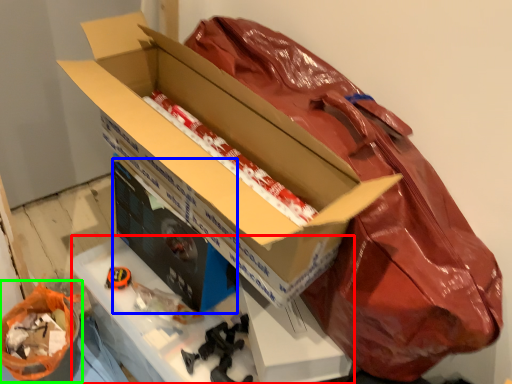
Question: Based on their relative distances, which object is farther from workbench (highlighted by a red box)? Choose from box (highlighted by a blue box) and wrapping paper (highlighted by a green box).

Choices:
 (A) box
 (B) wrapping paper

Answer: (B)